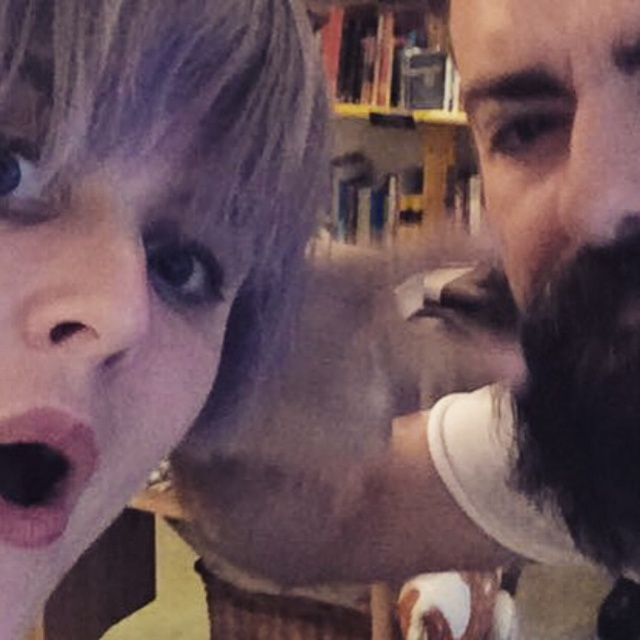
Is smooth skin face at center closer to camera compared to pink matte lips at center?

That is True.

Which is behind, point (134, 336) or point (54, 524)?

The point (54, 524) is more distant.

What do you see at coordinates (140, 250) in the screenshot? I see `smooth skin face at center` at bounding box center [140, 250].

Where is `smooth skin face at center`? The height and width of the screenshot is (640, 640). smooth skin face at center is located at coordinates (140, 250).

Is smooth skin face at center taller than black fuzzy beard at right?

Correct, smooth skin face at center is much taller as black fuzzy beard at right.

Does smooth skin face at center appear over black fuzzy beard at right?

Correct, smooth skin face at center is located above black fuzzy beard at right.

Between point (10, 275) and point (573, 445), which one is positioned behind?

The point (573, 445) is behind.

Locate an element on the screen. The image size is (640, 640). smooth skin face at center is located at coordinates (140, 250).

Is point (632, 307) positioned in front of point (36, 413)?

No, (632, 307) is behind (36, 413).

Between bearded man at center and pink matte lips at center, which one has less height?

With less height is pink matte lips at center.

You are a GUI agent. You are given a task and a screenshot of the screen. Output one action in this format:
    pyautogui.click(x=<x>, y=<y>)
    Task: Click on the bearded man at center
    Image resolution: width=640 pixels, height=640 pixels.
    Given the screenshot: What is the action you would take?
    pyautogui.click(x=518, y=339)

At what (x,y) coordinates should I click in order to perform the action: click on bearded man at center. Please return your answer as a coordinate pair (x, y). This screenshot has height=640, width=640. Looking at the image, I should click on (518, 339).